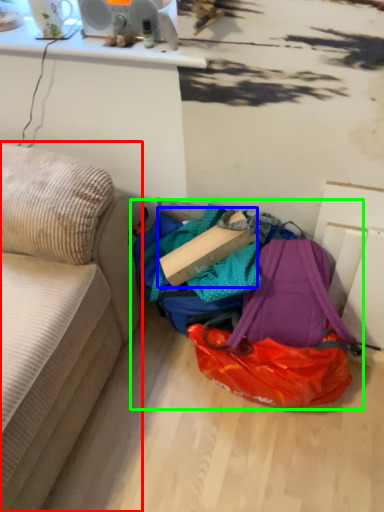
Question: Based on their relative distances, which object is nearer to studio couch (highlighted by a red box)? Choose from cardboard box (highlighted by a blue box) and bag (highlighted by a green box).

Choices:
 (A) cardboard box
 (B) bag

Answer: (A)